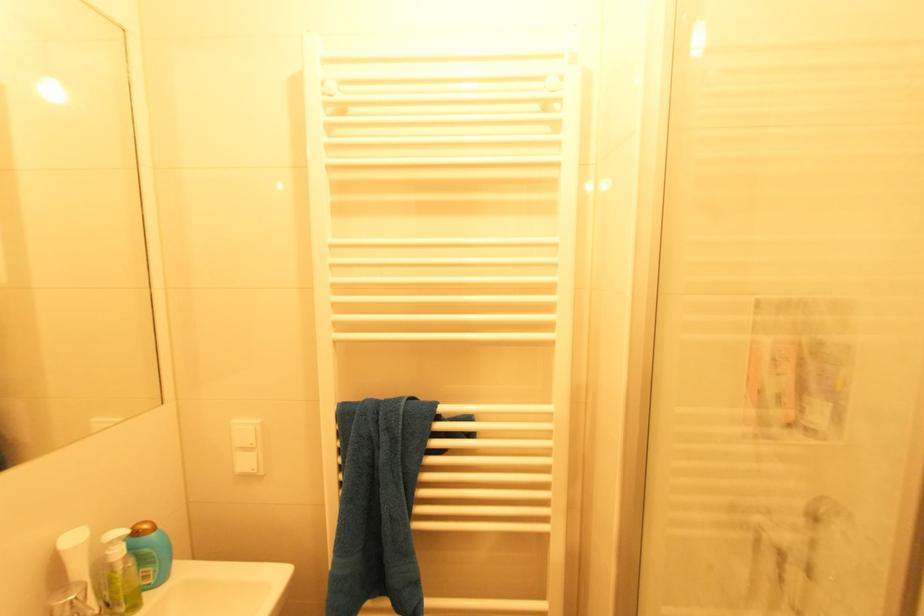
Find the location of `dispenser pump head`. dispenser pump head is located at coordinates (116, 536).